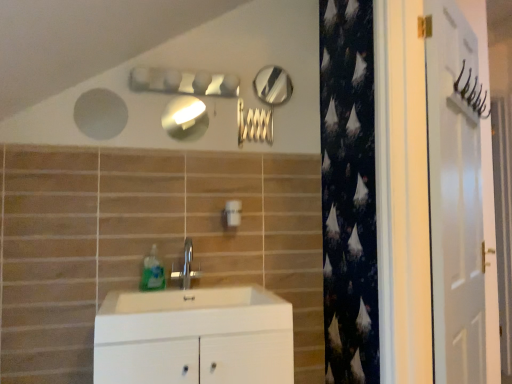
The width and height of the screenshot is (512, 384). What are the coordinates of `free location to the right of silver metallic faucet at center` in the screenshot? It's located at (223, 292).